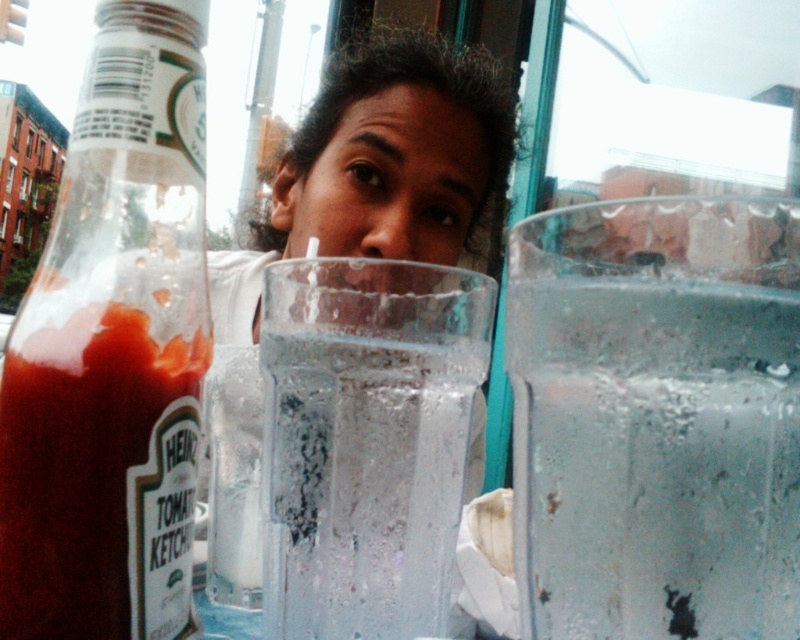
You are a customer at the outdoor cafe and want to grab the translucent glass bottle at left. Is it possible to reach it without moving the clear glass water at center?

The translucent glass bottle at left is located above the clear glass water at center, so you can reach the translucent glass bottle at left without moving the clear glass water at center because it is positioned higher.

Based on the photo, you are a customer at the outdoor cafe and want to place your phone on the table. The table has a bottle of Heinz Tomato Ketchup on the left and a clear glass ice at right. Where should you place your phone so it doesn not slide off the table?

You should place your phone away from the clear glass ice at right because it is located at point (656,419), which is near the edge of the table, increasing the risk of the phone sliding off.

You are a customer at the outdoor cafe and want to grab the clear glass ice at right and the clear glass water at center. Which one should you reach for first if you want to get the one closer to you?

The clear glass water at center is closer to you than the clear glass ice at right, so you should reach for the clear glass water at center first.